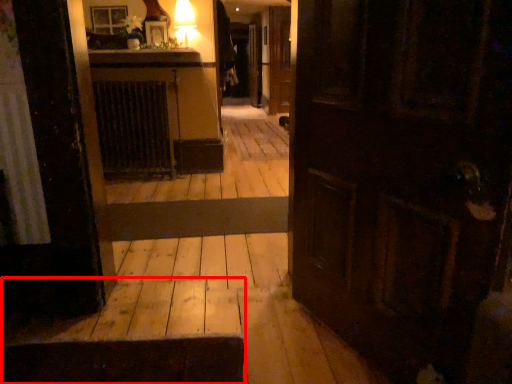
Question: From the image's perspective, where is stairwell (annotated by the red box) located in relation to radiator in the image?

Choices:
 (A) below
 (B) above

Answer: (A)